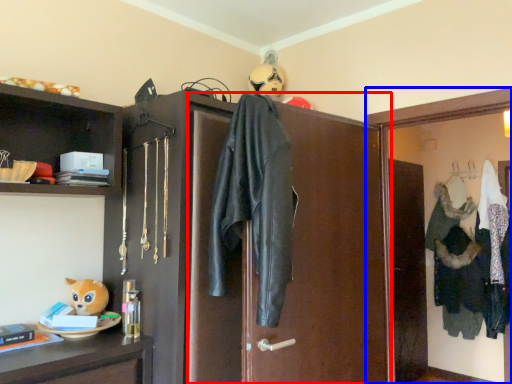
Question: Which of the following is the farthest to the observer, screen door (highlighted by a red box) or medicine cabinet (highlighted by a blue box)?

Choices:
 (A) screen door
 (B) medicine cabinet

Answer: (B)